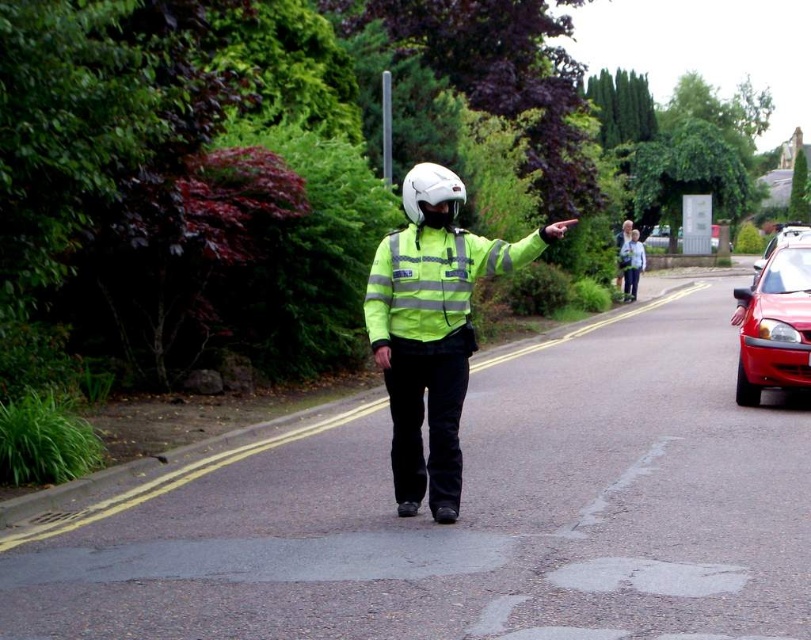
Question: Which point appears closest to the camera in this image?

Choices:
 (A) (638, 243)
 (B) (419, 189)
 (C) (402, 241)
 (D) (462, 380)

Answer: (B)

Question: Is white matte helmet at center smaller than metallic red car at right?

Choices:
 (A) yes
 (B) no

Answer: (A)

Question: Which is farther from the white matte helmet at center?

Choices:
 (A) high-visibility reflective jacket at center
 (B) metallic red car at right
 (C) shiny red car at right
 (D) high-visibility yellow jacket at center

Answer: (B)

Question: Which of these objects is positioned farthest from the light blue fabric jacket at center?

Choices:
 (A) high-visibility yellow jacket at center
 (B) shiny red car at right
 (C) white matte helmet at center

Answer: (A)

Question: Is high-visibility yellow jacket at center closer to camera compared to shiny red car at right?

Choices:
 (A) yes
 (B) no

Answer: (A)

Question: Does shiny red car at right appear under light blue fabric jacket at center?

Choices:
 (A) no
 (B) yes

Answer: (B)